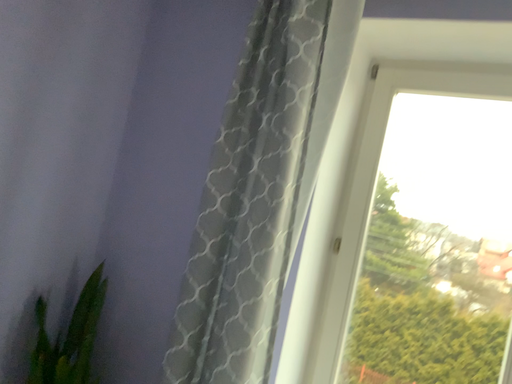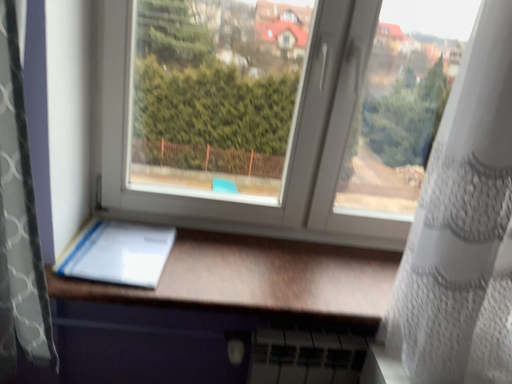
Question: Which way did the camera rotate in the video?

Choices:
 (A) rotated right
 (B) rotated left

Answer: (A)